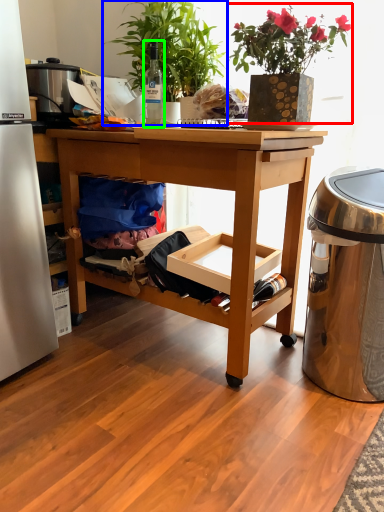
Question: Considering the real-world distances, which object is closest to houseplant (highlighted by a red box)? houseplant (highlighted by a blue box) or bottle (highlighted by a green box).

Choices:
 (A) houseplant
 (B) bottle

Answer: (A)